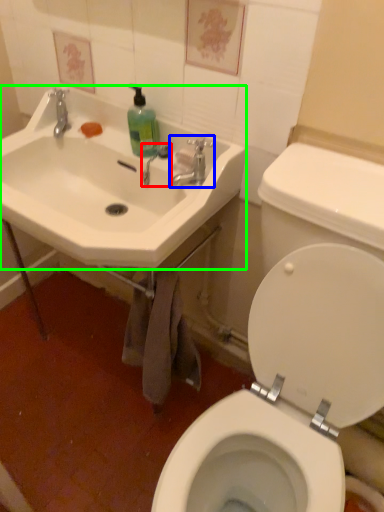
Question: Which object is the farthest from plumbing fixture (highlighted by a red box)? Choose among these: tap (highlighted by a blue box) or sink (highlighted by a green box).

Choices:
 (A) tap
 (B) sink

Answer: (B)